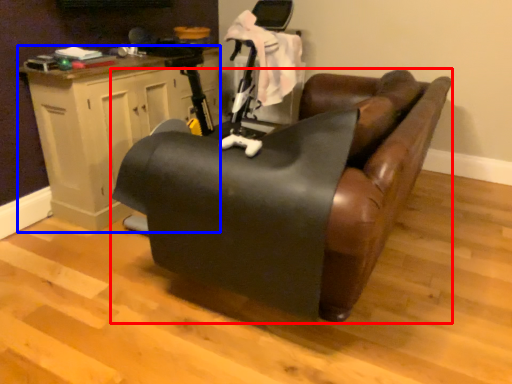
Question: Which object appears farthest to the camera in this image, furniture (highlighted by a red box) or table (highlighted by a blue box)?

Choices:
 (A) furniture
 (B) table

Answer: (B)